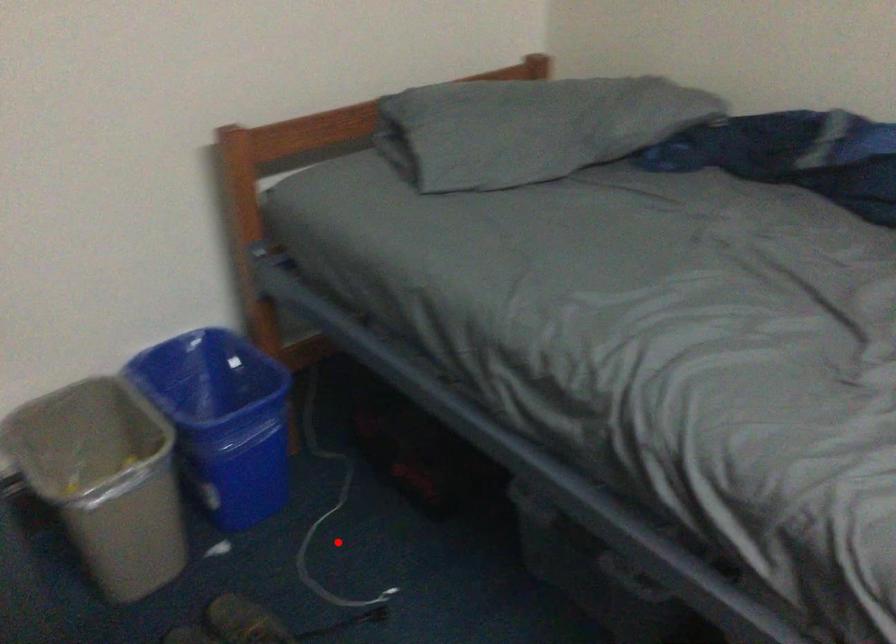
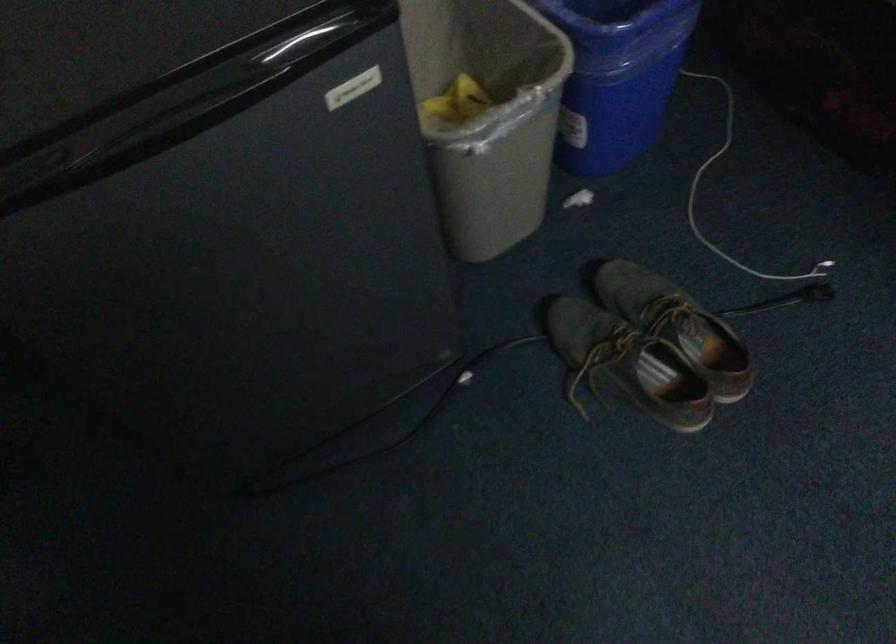
Locate, in the second image, the point that corresponds to the highlighted location in the first image.

(734, 196)